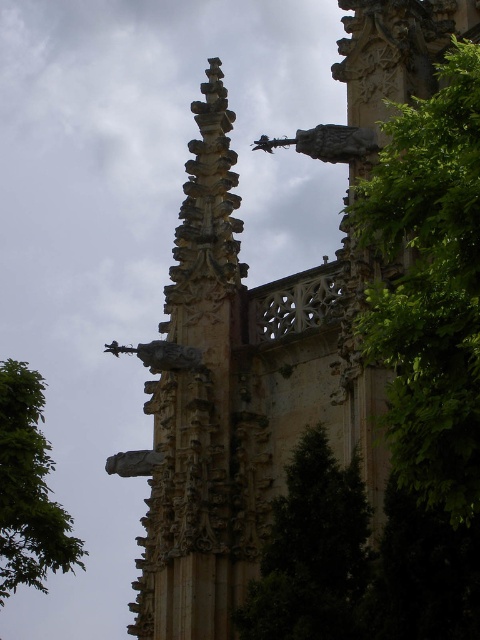
Between green leafy tree at right and green leafy tree at left, which one appears on the right side from the viewer's perspective?

From the viewer's perspective, green leafy tree at right appears more on the right side.

Who is more forward, (432, 476) or (1, 602)?

Point (432, 476) is more forward.

Who is more forward, (406, 448) or (39, 486)?

Point (406, 448) is in front.

Image resolution: width=480 pixels, height=640 pixels. What are the coordinates of `green leafy tree at right` in the screenshot? It's located at (430, 284).

Based on the photo, is green leafy tree at center thinner than green leafy tree at left?

Yes.

Between green leafy tree at center and green leafy tree at left, which one is positioned higher?

green leafy tree at left is higher up.

Is point (348, 481) positioned behind point (1, 376)?

No, it is not.

Identify the location of green leafy tree at center. The height and width of the screenshot is (640, 480). (312, 552).

At what (x,y) coordinates should I click in order to perform the action: click on green leafy tree at left. Please return your answer as a coordinate pair (x, y). The height and width of the screenshot is (640, 480). Looking at the image, I should click on (28, 488).

Does green leafy tree at left have a smaller size compared to polished stone statue at center?

No, green leafy tree at left is not smaller than polished stone statue at center.

Does point (25, 529) lie in front of point (180, 358)?

Yes.

The width and height of the screenshot is (480, 640). What are the coordinates of `green leafy tree at left` in the screenshot? It's located at (28, 488).